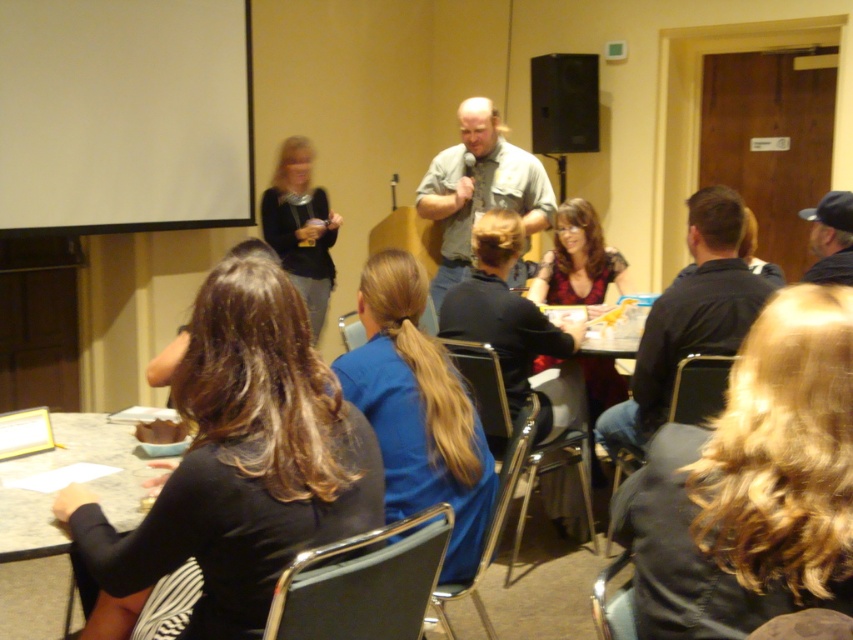
You are a speaker in a conference room. You want to move from your current position to the white matte projection screen at upper left to adjust it. However, there is a matte black sweater at center on the table. Can you reach the screen without moving the sweater?

The white matte projection screen at upper left is 26.16 inches away from the matte black sweater at center. Since the distance between them is about 26 inches, you can likely reach the screen without moving the sweater, as this distance allows for easy access while avoiding the sweater.

You are sitting at the back of the conference room and want to ask a question to the speaker. You notice two people in the front row wearing a black shirt at center and a denim shirt at center. Which one is closer to you?

The black shirt at center is closer to the viewer than denim shirt at center, so the black shirt at center is closer to you.